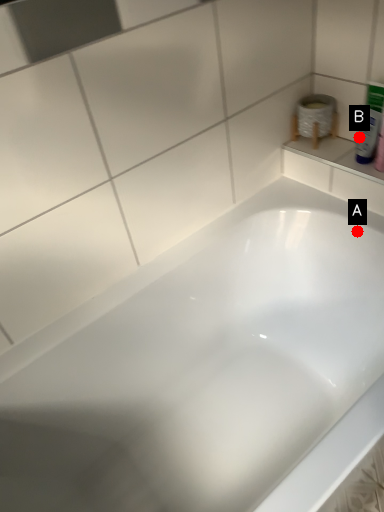
Question: Two points are circled on the image, labeled by A and B beside each circle. Which point is closer to the camera taking this photo?

Choices:
 (A) A is closer
 (B) B is closer

Answer: (A)